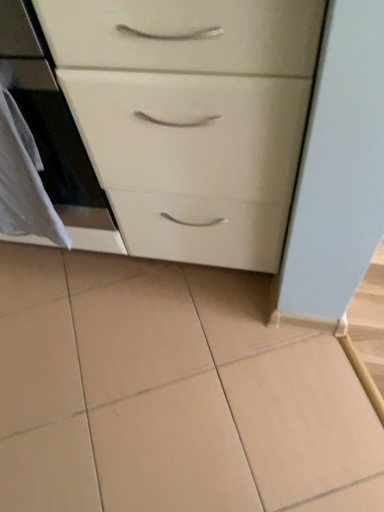
Question: Does point click(180, 37) appear closer or farther from the camera than point click(16, 146)?

Choices:
 (A) farther
 (B) closer

Answer: (B)

Question: Looking at the image, does white glossy chest of drawers at center seem bigger or smaller compared to white fabric at left?

Choices:
 (A) small
 (B) big

Answer: (B)

Question: Which object is the closest to the white glossy oven at left?

Choices:
 (A) white fabric at left
 (B) white glossy chest of drawers at center

Answer: (A)

Question: Which object is positioned closest to the white glossy chest of drawers at center?

Choices:
 (A) white fabric at left
 (B) white glossy oven at left

Answer: (B)